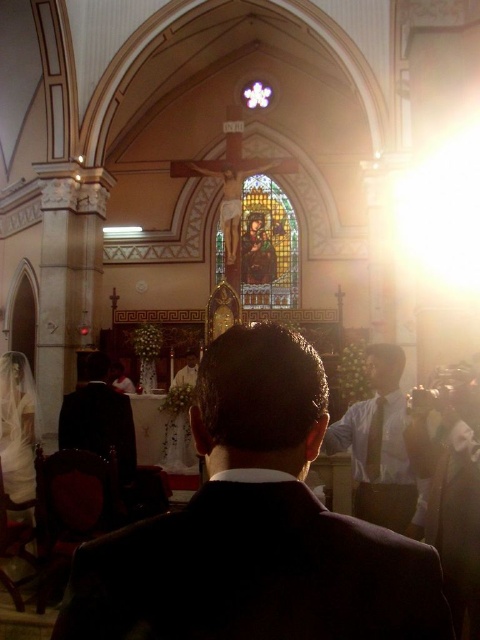
Who is shorter, white shirt at center or stained glass window at center?

Standing shorter between the two is white shirt at center.

Can you confirm if white shirt at center is positioned to the right of stained glass window at center?

Yes, white shirt at center is to the right of stained glass window at center.

Where is `white shirt at center`? The width and height of the screenshot is (480, 640). white shirt at center is located at coordinates (384, 449).

Where is `white shirt at center`? This screenshot has height=640, width=480. white shirt at center is located at coordinates (384, 449).

Can you confirm if dark suit at center is thinner than white shirt at center?

No.

Between dark suit at center and white shirt at center, which one is positioned higher?

Positioned higher is dark suit at center.

Identify the location of dark suit at center. This screenshot has width=480, height=640. (255, 528).

Identify the location of white shirt at center. This screenshot has height=640, width=480. [x=384, y=449].

Is point (374, 456) more distant than point (92, 417)?

No, (374, 456) is closer to viewer.

You are a GUI agent. You are given a task and a screenshot of the screen. Output one action in this format:
    pyautogui.click(x=<x>, y=<y>)
    Task: Click on the white shirt at center
    The image size is (480, 640).
    Given the screenshot: What is the action you would take?
    pyautogui.click(x=384, y=449)

The width and height of the screenshot is (480, 640). I want to click on white shirt at center, so click(x=384, y=449).